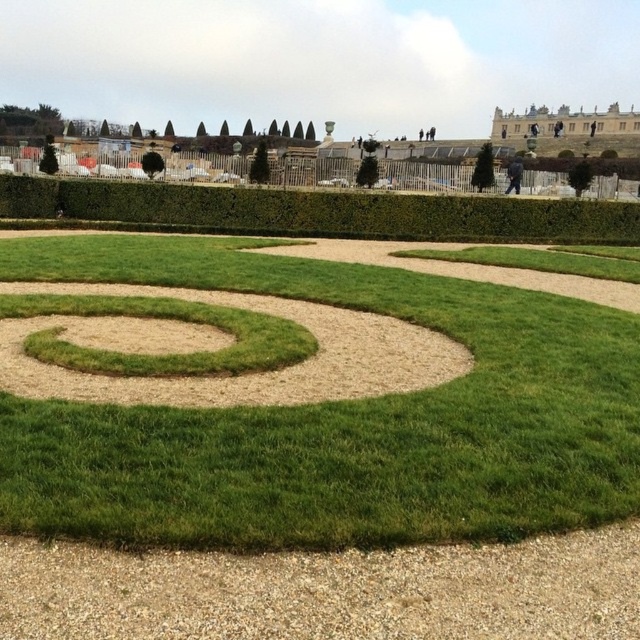
Question: Is green grass at center further to the viewer compared to gray gravel at bottom?

Choices:
 (A) yes
 (B) no

Answer: (A)

Question: Which of the following is the closest to the observer?

Choices:
 (A) (84, 196)
 (B) (317, 582)

Answer: (B)

Question: Which of the following is the farthest from the observer?

Choices:
 (A) green grass at center
 (B) gray gravel at bottom

Answer: (A)

Question: Is green grass at center below green grass spiral at center?

Choices:
 (A) yes
 (B) no

Answer: (B)

Question: Is gray gravel at bottom further to the viewer compared to green hedge at upper center?

Choices:
 (A) no
 (B) yes

Answer: (A)

Question: Which point is closer to the camera?

Choices:
 (A) green hedge at upper center
 (B) green grass at center
 (C) green grass spiral at center
 (D) gray gravel at bottom

Answer: (D)